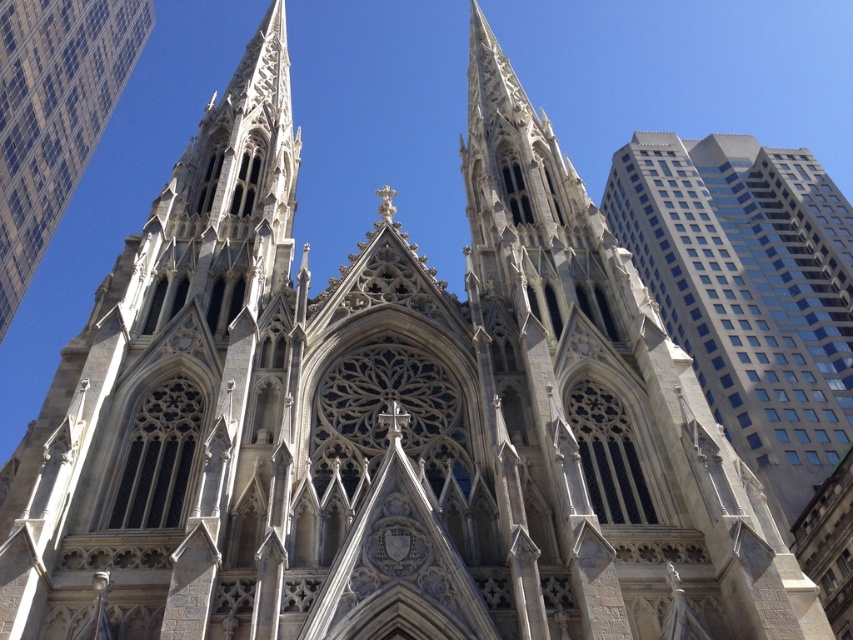
Question: Is glassy reflective skyscraper at right bigger than white stone tower at upper left?

Choices:
 (A) yes
 (B) no

Answer: (A)

Question: Is glassy reflective skyscraper at right positioned at the back of white stone tower at upper left?

Choices:
 (A) no
 (B) yes

Answer: (A)

Question: Can you confirm if glassy reflective skyscraper at right is positioned to the right of white stone tower at upper left?

Choices:
 (A) no
 (B) yes

Answer: (B)

Question: Which point is closer to the camera taking this photo?

Choices:
 (A) (24, 269)
 (B) (724, 340)

Answer: (A)